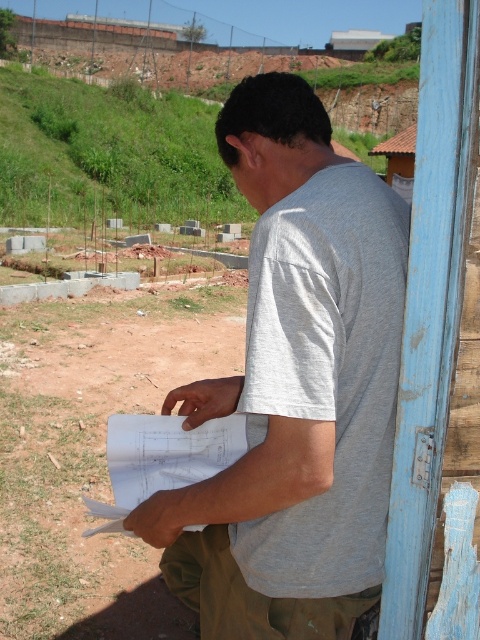
You are a drone operator tasked with capturing aerial footage of the construction site. You need to ensure that the man in the gray matte shirt at center is centered in the frame. Given his exact coordinates at point 0.606, 0.617, what adjustment should you make to the drone camera to center him?

To center the gray matte shirt at center at coordinates (296, 387), adjust the drone camera so that the crosshairs align precisely with those coordinates, ensuring the man is centered in the frame.

You are a construction worker who needs to place a 2 meter tall safety sign. You see the gray matte shirt at center and the brown dirt field at lower left. Which object is tall enough to attach the sign to?

The gray matte shirt at center is much taller than the brown dirt field at lower left, so the safety sign can be attached to the gray matte shirt at center.